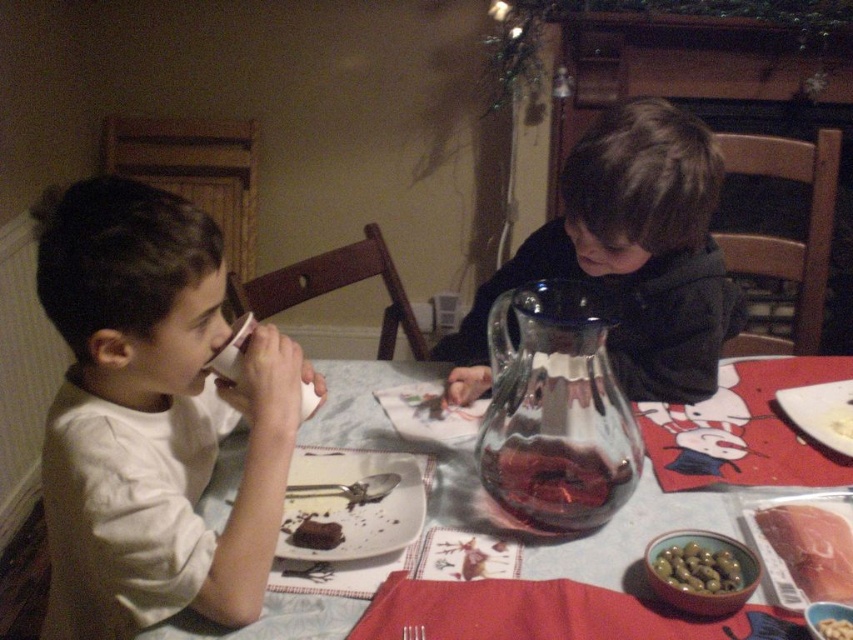
Question: Which is nearer to the transparent glass pitcher at center?

Choices:
 (A) dark blue fabric jacket at upper right
 (B) white matte cup at left

Answer: (A)

Question: Which object appears farthest from the camera in this image?

Choices:
 (A) dark blue fabric jacket at upper right
 (B) transparent glass pitcher at center
 (C) white matte cup at left

Answer: (A)

Question: Can you confirm if glassy plastic jug at center is positioned to the right of smooth yellow cheese at lower right?

Choices:
 (A) yes
 (B) no

Answer: (B)

Question: Estimate the real-world distances between objects in this image. Which object is farther from the green olive at center?

Choices:
 (A) white matte cup at left
 (B) transparent glass pitcher at center
 (C) smooth yellow cheese at lower right

Answer: (A)

Question: Is the position of dark blue fabric jacket at upper right more distant than that of chocolate cake at center?

Choices:
 (A) no
 (B) yes

Answer: (B)

Question: Does white matte cup at left appear under glassy plastic jug at center?

Choices:
 (A) yes
 (B) no

Answer: (B)